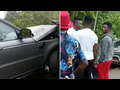
The image size is (120, 90). I want to click on window, so click(7, 31).